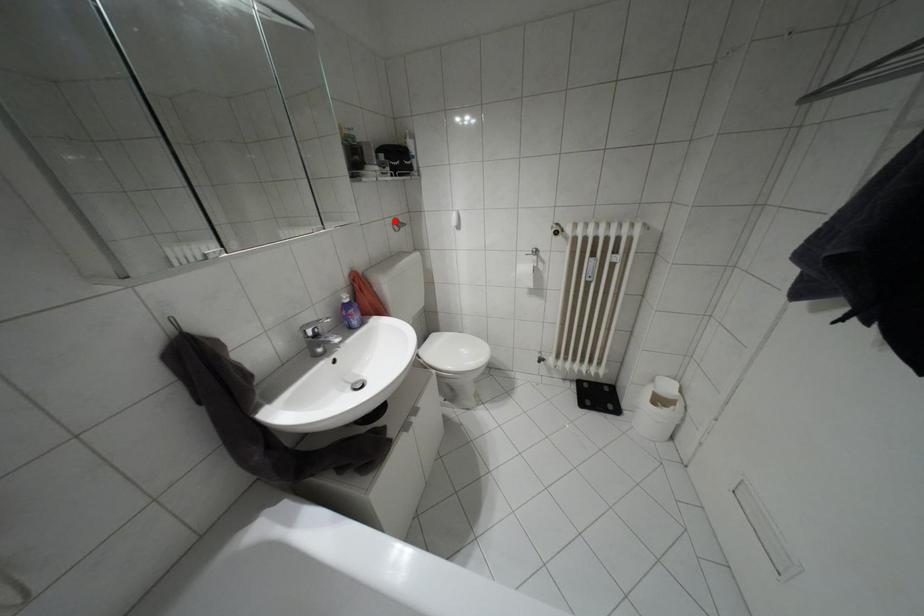
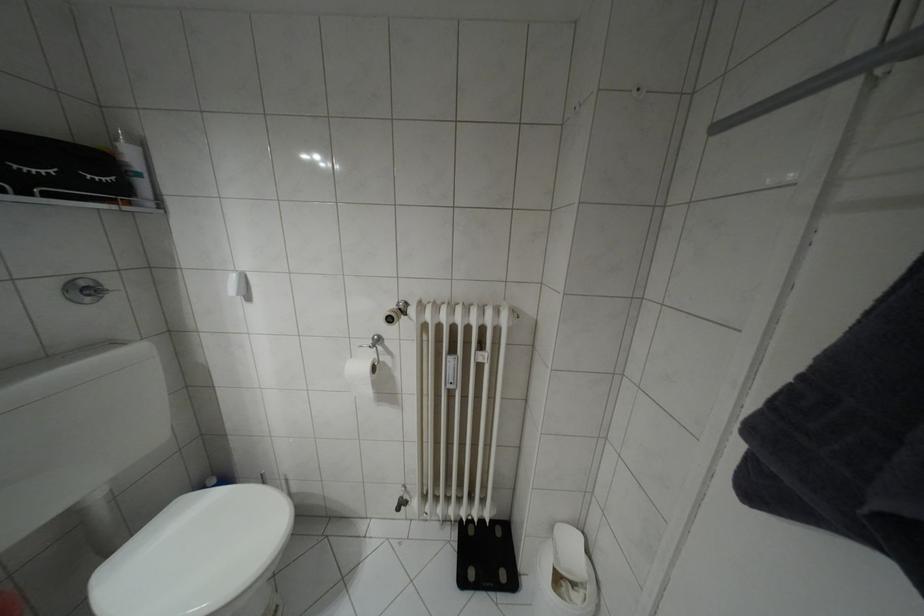
Question: I am providing you with two images of the same scene from different viewpoints. Given a red point in image1, look at the same physical point in image2. Is it:

Choices:
 (A) Closer to the viewpoint
 (B) Farther from the viewpoint

Answer: (B)